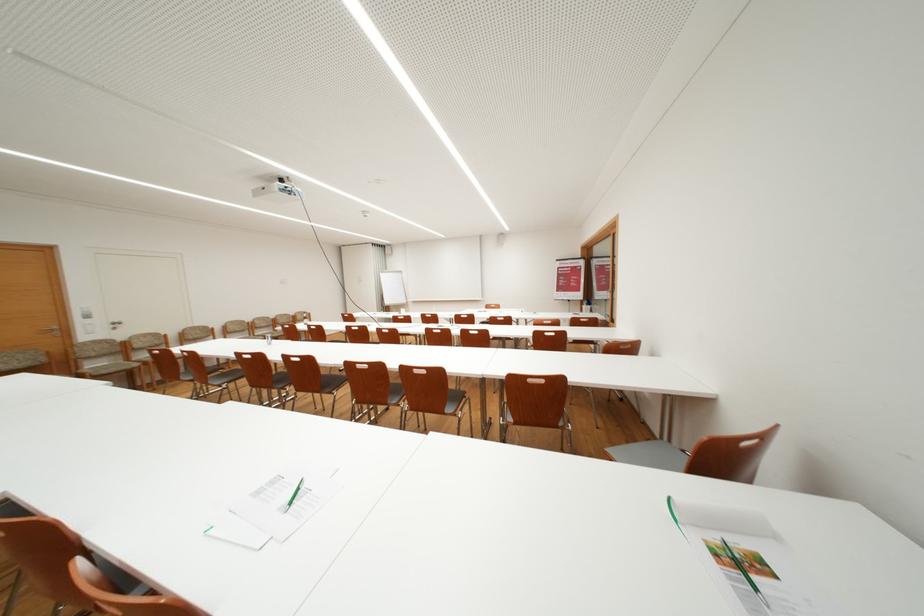
Where is `white clipboard`? white clipboard is located at coordinates (274, 507).